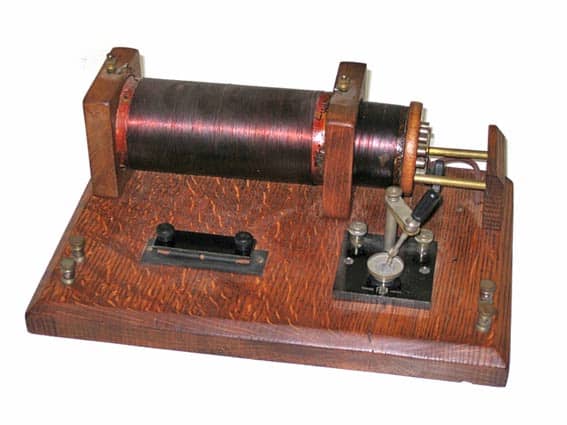
You are a GUI agent. You are given a task and a screenshot of the screen. Output one action in this format:
    pyautogui.click(x=<x>, y=<y>)
    Task: Click on the curved wood piece
    
    Given the screenshot: What is the action you would take?
    pyautogui.click(x=501, y=145), pyautogui.click(x=409, y=140)